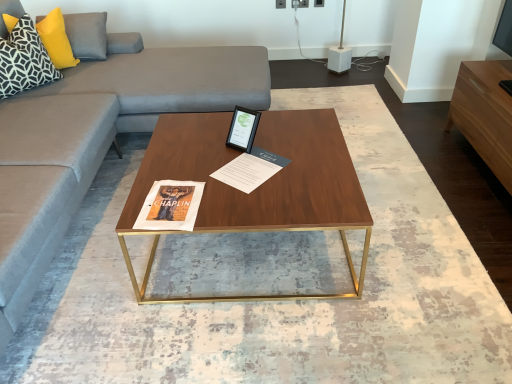
Locate an element on the screen. The height and width of the screenshot is (384, 512). free space below matte paper magazine at center (from a real-world perspective) is located at coordinates (248, 165).